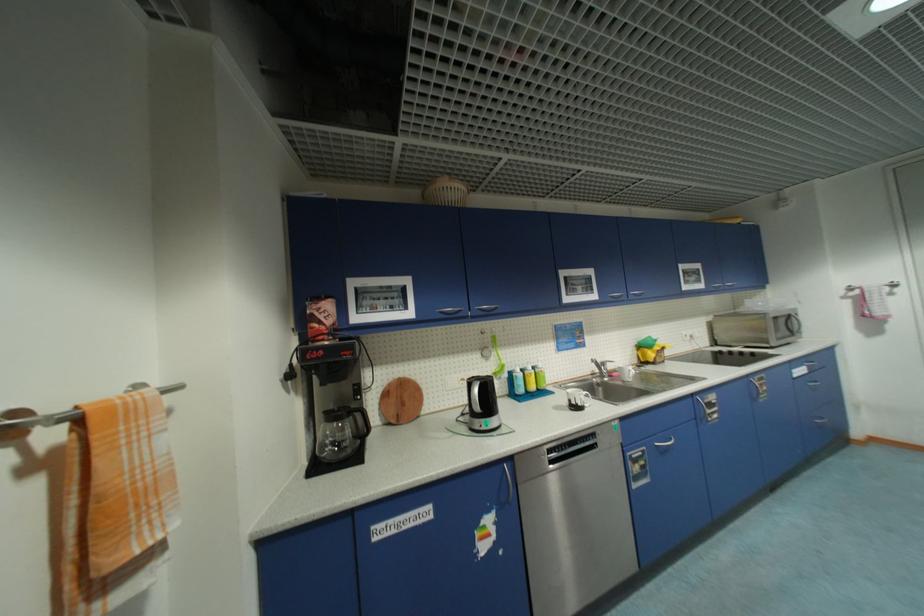
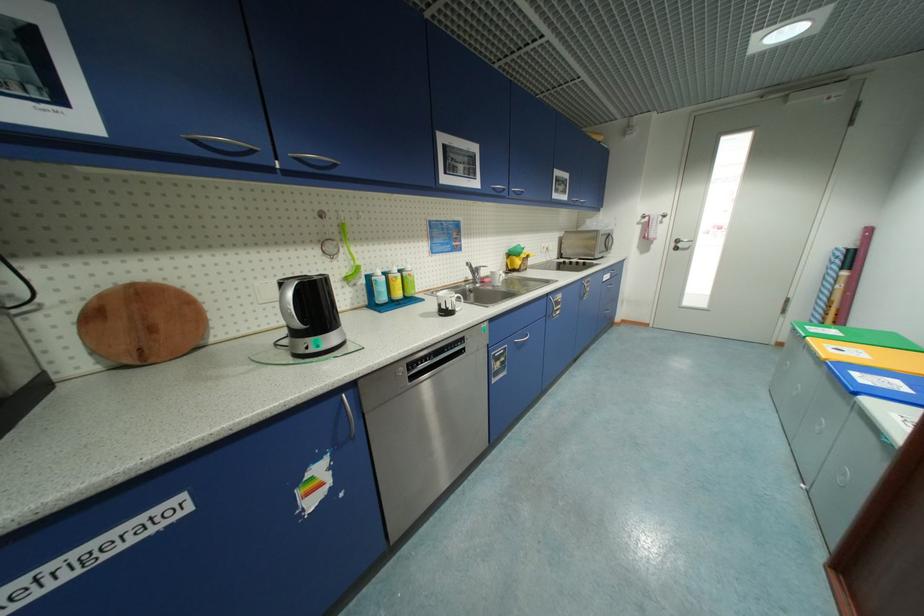
Find the pixel in the second image that matches (x=707, y=286) in the first image.

(570, 199)